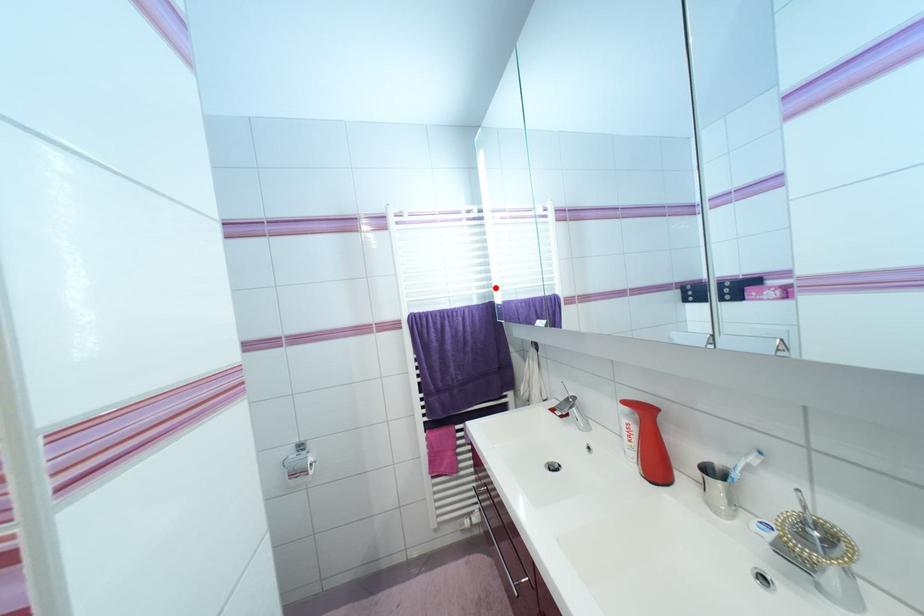
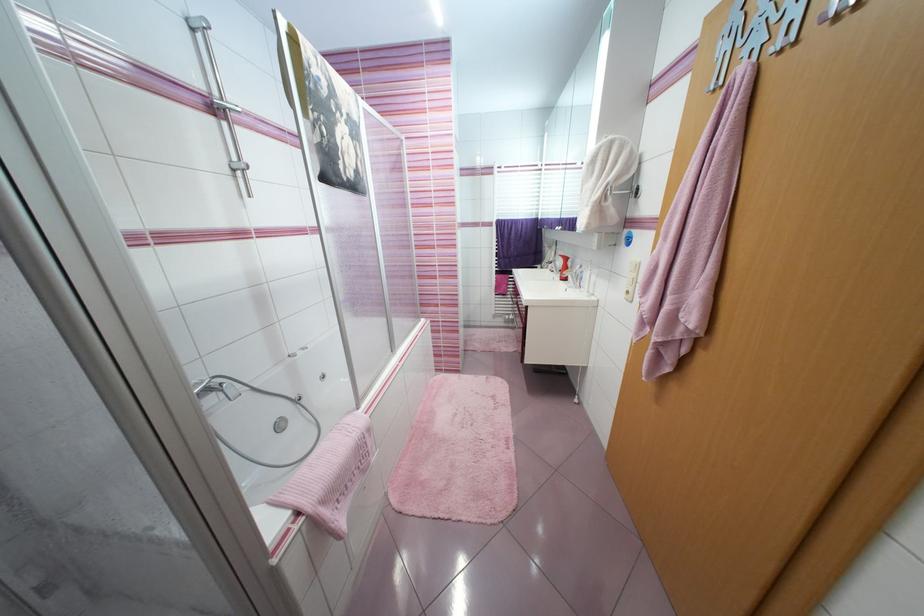
Question: I am providing you with two images of the same scene from different viewpoints. In image1, a red point is highlighted. Considering the same 3D point in image2, which of the following is correct?

Choices:
 (A) It is closer
 (B) It is farther

Answer: (A)